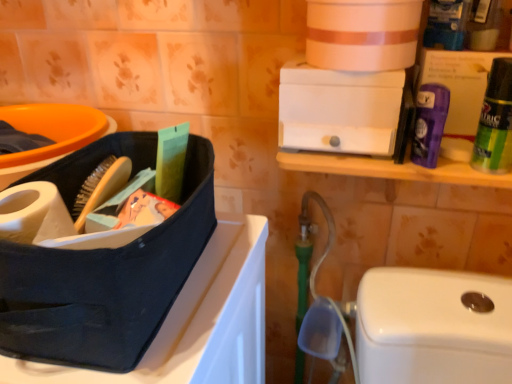
Question: Should I look upward or downward to see purple matte deodorant at upper right, which is the 1th cleaning product from left to right?

Choices:
 (A) down
 (B) up

Answer: (B)

Question: Is white plastic drawer at upper center at the left side of green matte fabric softener at upper right, the 2th cleaning product positioned from the left?

Choices:
 (A) no
 (B) yes

Answer: (B)

Question: Is white plastic drawer at upper center not near green matte fabric softener at upper right, positioned as the first cleaning product in right-to-left order?

Choices:
 (A) yes
 (B) no

Answer: (B)

Question: From a real-world perspective, is white plastic drawer at upper center under green matte fabric softener at upper right, the 2th cleaning product positioned from the left?

Choices:
 (A) no
 (B) yes

Answer: (B)

Question: From the image's perspective, does white plastic drawer at upper center appear lower than green matte fabric softener at upper right, the 2th cleaning product positioned from the left?

Choices:
 (A) yes
 (B) no

Answer: (B)

Question: Is white plastic drawer at upper center facing away from green matte fabric softener at upper right, positioned as the first cleaning product in right-to-left order?

Choices:
 (A) no
 (B) yes

Answer: (A)

Question: Can you confirm if white plastic drawer at upper center is wider than green matte fabric softener at upper right, positioned as the first cleaning product in right-to-left order?

Choices:
 (A) yes
 (B) no

Answer: (A)

Question: Can you confirm if green matte fabric softener at upper right, the 2th cleaning product positioned from the left, is taller than purple matte deodorant at upper right?

Choices:
 (A) yes
 (B) no

Answer: (A)

Question: Is green matte fabric softener at upper right, positioned as the first cleaning product in right-to-left order, bigger than purple matte deodorant at upper right?

Choices:
 (A) no
 (B) yes

Answer: (A)

Question: Would you say green matte fabric softener at upper right, the 2th cleaning product positioned from the left, contains purple matte deodorant at upper right?

Choices:
 (A) no
 (B) yes

Answer: (A)

Question: From the image's perspective, is green matte fabric softener at upper right, positioned as the first cleaning product in right-to-left order, above purple matte deodorant at upper right?

Choices:
 (A) no
 (B) yes

Answer: (A)

Question: From a real-world perspective, is green matte fabric softener at upper right, the 2th cleaning product positioned from the left, physically above purple matte deodorant at upper right?

Choices:
 (A) yes
 (B) no

Answer: (A)

Question: Is green matte fabric softener at upper right, positioned as the first cleaning product in right-to-left order, further to the viewer compared to purple matte deodorant at upper right?

Choices:
 (A) yes
 (B) no

Answer: (B)

Question: Does matte black lunch box at left have a smaller size compared to green matte fabric softener at upper right, the 2th cleaning product positioned from the left?

Choices:
 (A) no
 (B) yes

Answer: (A)